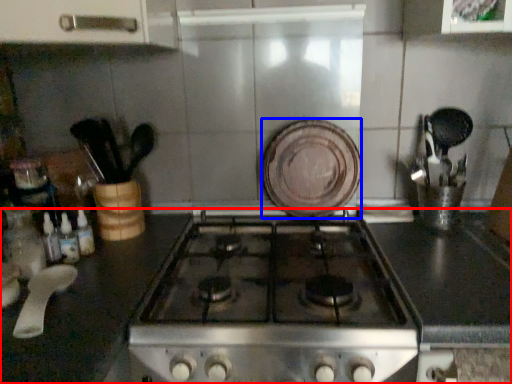
Question: Which of the following is the farthest to the observer, countertop (highlighted by a red box) or plate (highlighted by a blue box)?

Choices:
 (A) countertop
 (B) plate

Answer: (B)